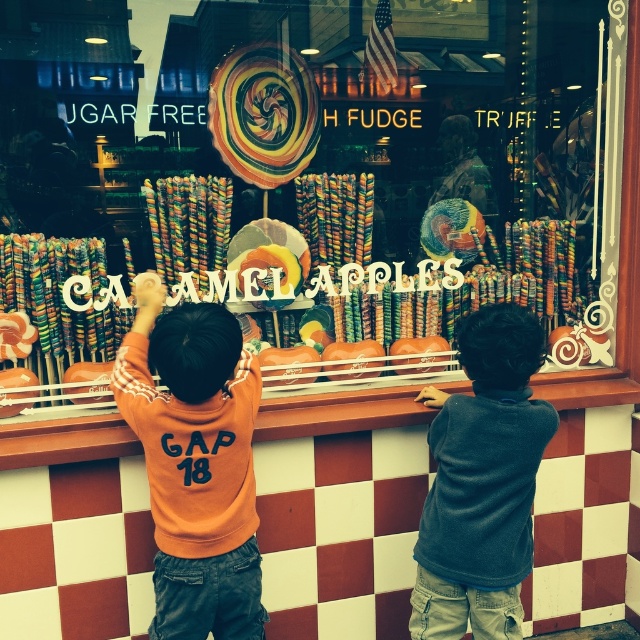
Question: Which point is farther to the camera?

Choices:
 (A) (449, 211)
 (B) (269, 161)
 (C) (435, 573)
 (D) (198, 561)

Answer: (A)

Question: Considering the real-world distances, which object is farthest from the orange fleece sweatshirt at left?

Choices:
 (A) shiny metallic lollipop at center
 (B) swirled glass lollipop at center

Answer: (A)

Question: Which point is farther from the camera taking this photo?

Choices:
 (A) (163, 424)
 (B) (458, 209)
 (C) (509, 317)
 (D) (289, 74)

Answer: (B)

Question: Is swirled glass lollipop at center bigger than shiny metallic lollipop at center?

Choices:
 (A) yes
 (B) no

Answer: (A)

Question: Is orange fleece sweatshirt at left further to the viewer compared to swirled glass lollipop at center?

Choices:
 (A) yes
 (B) no

Answer: (B)

Question: Does orange fleece sweatshirt at left lie in front of swirled glass lollipop at center?

Choices:
 (A) yes
 (B) no

Answer: (A)